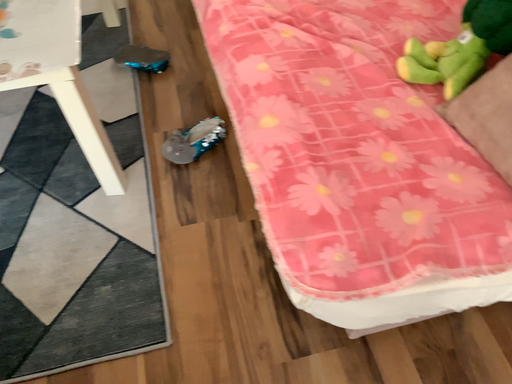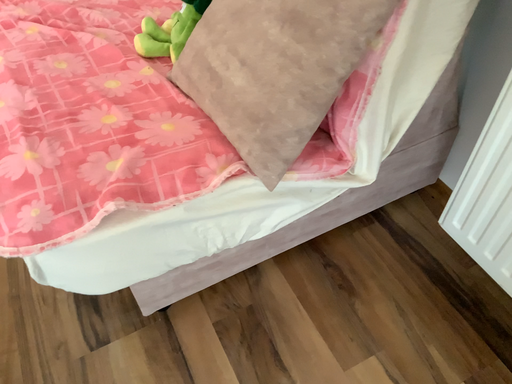
Question: Which way did the camera rotate in the video?

Choices:
 (A) rotated right
 (B) rotated left

Answer: (A)